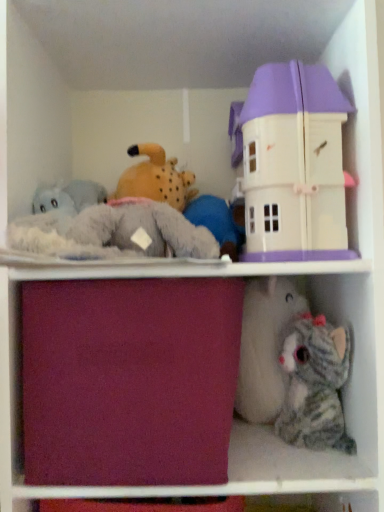
Question: From a real-world perspective, is burgundy fabric drawer at center above or below pastel purple plastic dollhouse at upper right, marked as the 1th toy in a top-to-bottom arrangement?

Choices:
 (A) above
 (B) below

Answer: (B)

Question: Is burgundy fabric drawer at center inside the boundaries of pastel purple plastic dollhouse at upper right, placed as the 2th toy when sorted from bottom to top, or outside?

Choices:
 (A) outside
 (B) inside

Answer: (A)

Question: Estimate the real-world distances between objects in this image. Which object is closer to the striped plush cat at lower right, marked as the 1th toy in a bottom-to-top arrangement?

Choices:
 (A) pastel purple plastic dollhouse at upper right, placed as the 2th toy when sorted from bottom to top
 (B) burgundy fabric drawer at center

Answer: (A)

Question: Estimate the real-world distances between objects in this image. Which object is closer to the pastel purple plastic dollhouse at upper right, placed as the 2th toy when sorted from bottom to top?

Choices:
 (A) burgundy fabric drawer at center
 (B) striped plush cat at lower right, marked as the 1th toy in a bottom-to-top arrangement

Answer: (A)